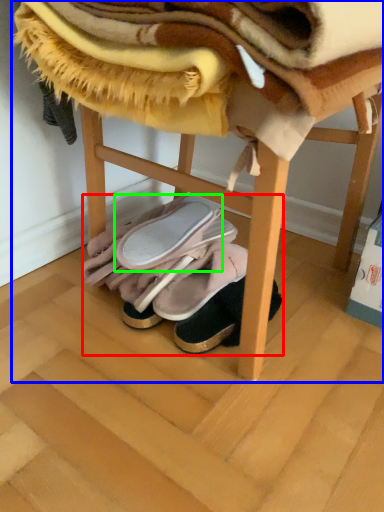
Question: Based on their relative distances, which object is farther from footwear (highlighted by a red box)? Choose from furniture (highlighted by a blue box) and footwear (highlighted by a green box).

Choices:
 (A) furniture
 (B) footwear

Answer: (A)